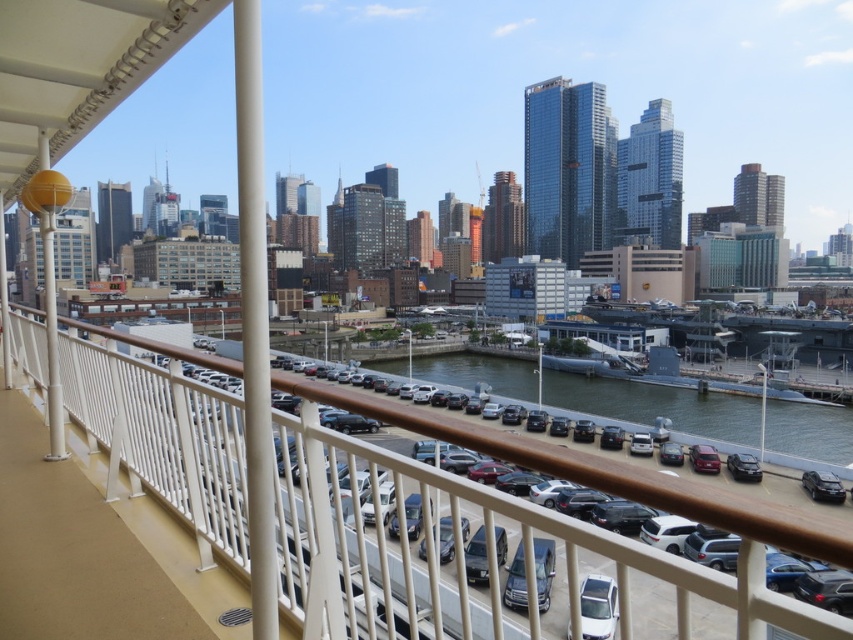
Does white metal railing at center have a greater width compared to satin black sedan at center?

Indeed, white metal railing at center has a greater width compared to satin black sedan at center.

Between point (506, 497) and point (538, 561), which one is positioned in front?

Positioned in front is point (506, 497).

Does point (144, 384) come in front of point (541, 547)?

Yes, it is.

Locate an element on the screen. The height and width of the screenshot is (640, 853). white metal railing at center is located at coordinates (456, 556).

In the scene shown: Who is positioned more to the left, satin black sedan at center or white glossy car at center?

satin black sedan at center is more to the left.

Which is above, satin black sedan at center or white glossy car at center?

white glossy car at center is higher up.

What do you see at coordinates (543, 570) in the screenshot? This screenshot has width=853, height=640. I see `satin black sedan at center` at bounding box center [543, 570].

The height and width of the screenshot is (640, 853). I want to click on satin black sedan at center, so click(543, 570).

Which is more to the right, white metal railing at center or shiny black sedan at lower right?

Positioned to the right is shiny black sedan at lower right.

Is white metal railing at center wider than shiny black sedan at lower right?

Yes.

What do you see at coordinates (456, 556) in the screenshot? I see `white metal railing at center` at bounding box center [456, 556].

Where is `white metal railing at center`? This screenshot has width=853, height=640. white metal railing at center is located at coordinates (456, 556).